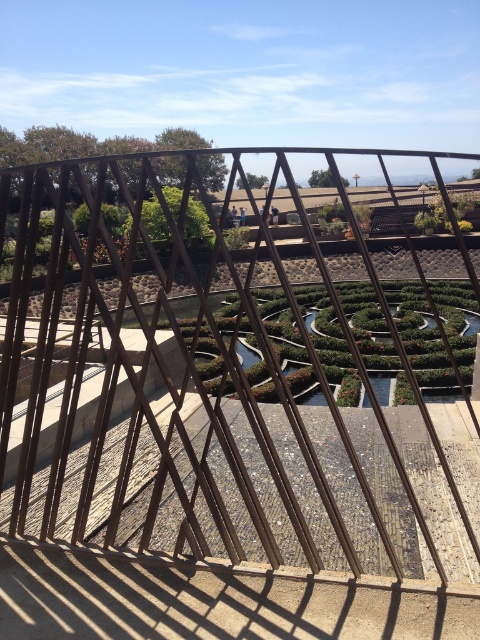
What do you see at coordinates (231, 372) in the screenshot?
I see `metallic wire fence at center` at bounding box center [231, 372].

What are the coordinates of `metallic wire fence at center` in the screenshot? It's located at (231, 372).